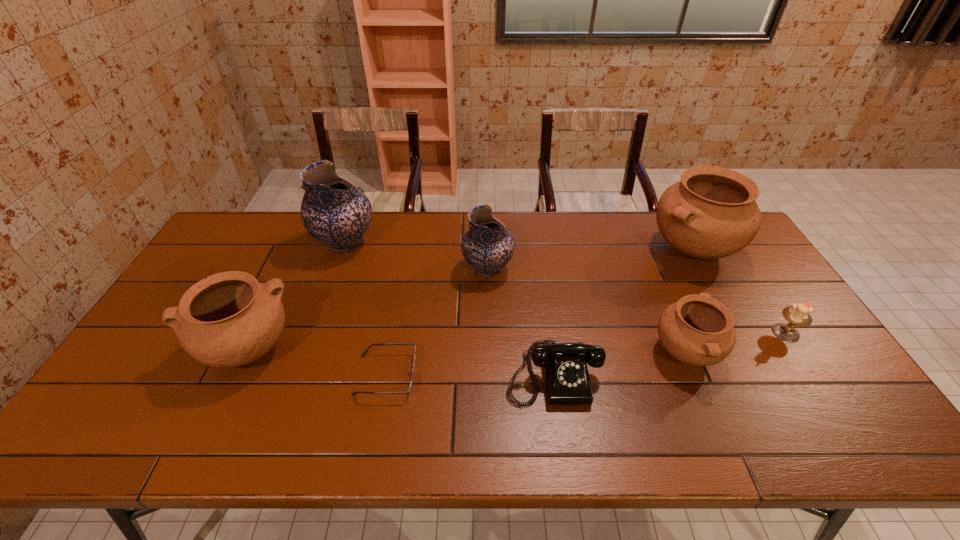
The image size is (960, 540). Find the location of `the sixth object from right to left`. the sixth object from right to left is located at coordinates (363, 355).

At what (x,y) coordinates should I click in order to perform the action: click on free spot located on the left of the bigger blue pottery. Please return your answer as a coordinate pair (x, y). The height and width of the screenshot is (540, 960). Looking at the image, I should click on point(252,243).

This screenshot has height=540, width=960. In order to click on vacant space located 0.340m on the left of the biggest terracotta pottery in this screenshot , I will do `click(545, 248)`.

Identify the location of free space located on the right of the third pottery from right to left. Image resolution: width=960 pixels, height=540 pixels. (629, 268).

The width and height of the screenshot is (960, 540). I want to click on vacant space located on the left of the second biggest terracotta pottery, so click(x=156, y=349).

Locate an element on the screen. Image resolution: width=960 pixels, height=540 pixels. vacant space located 0.140m on the left of the smallest terracotta pottery is located at coordinates (599, 353).

Where is `vacant space located 0.260m on the left of the candle holder`? vacant space located 0.260m on the left of the candle holder is located at coordinates (679, 333).

The image size is (960, 540). I want to click on vacant area situated 0.080m on the dial of the telephone, so click(563, 440).

The height and width of the screenshot is (540, 960). I want to click on vacant space situated 0.400m on the front-facing side of the third object from left to right, so click(x=573, y=375).

The width and height of the screenshot is (960, 540). Find the location of `object at the left edge`. object at the left edge is located at coordinates (229, 319).